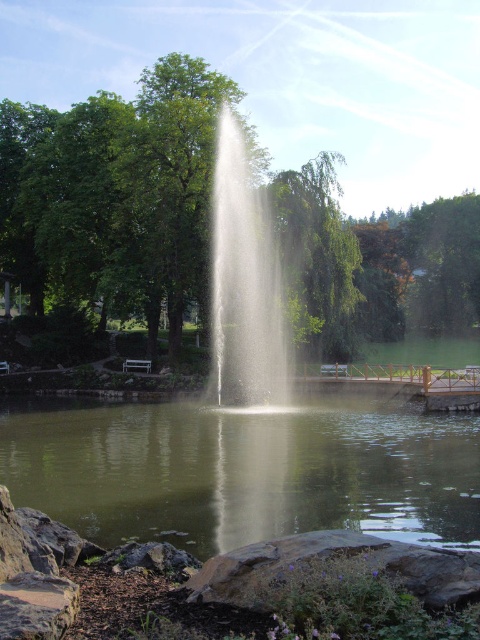
You are standing at the edge of the park scene and want to know if the clear water at center is wider than the white misty fountain at center. Can you determine this based on the scene?

The clear water at center might be wider than the white misty fountain at center according to the description.

You are standing at the edge of the park fountain and want to locate the clear water at center. According to the coordinates provided, which direction should you look to find it?

You should look towards the center of the fountain, as the clear water at center is located at point coordinates (244, 470).

You are a photographer planning to capture the clear water at center and the white misty fountain at center in a single shot. Which object should you focus on first if you want to ensure both are in sharp focus?

The clear water at center has a smaller size compared to the white misty fountain at center, so focusing on the white misty fountain at center first would help ensure both are in focus since it is larger and covers more area.